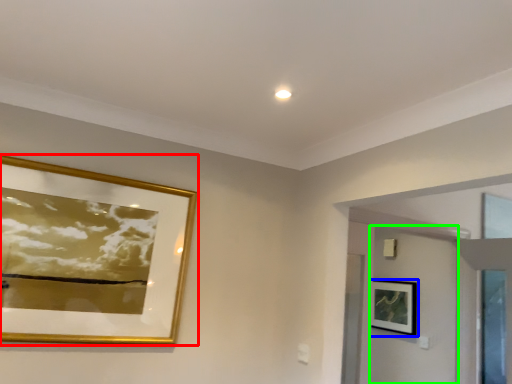
Question: Based on their relative distances, which object is farther from picture frame (highlighted by a red box)? Choose from picture frame (highlighted by a blue box) and door (highlighted by a green box).

Choices:
 (A) picture frame
 (B) door

Answer: (A)